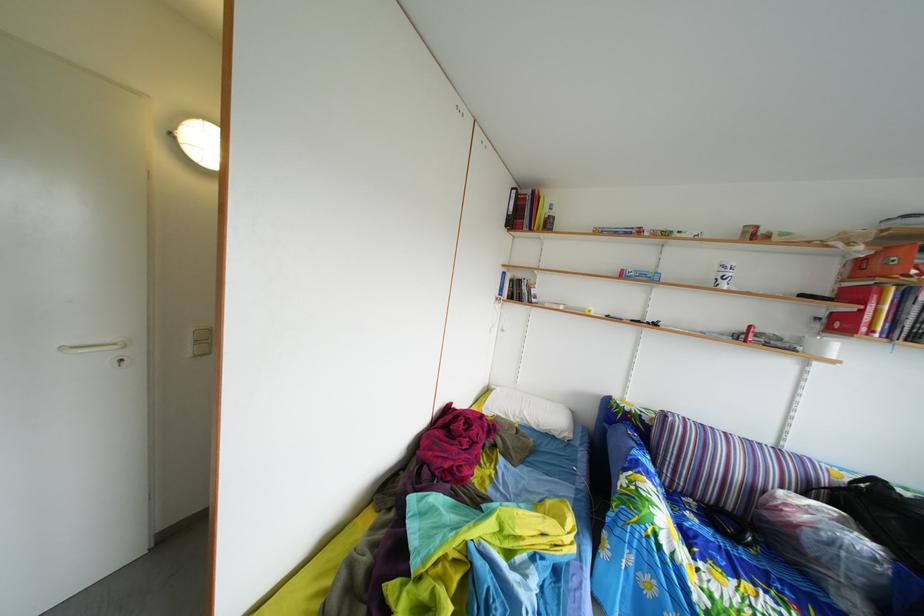
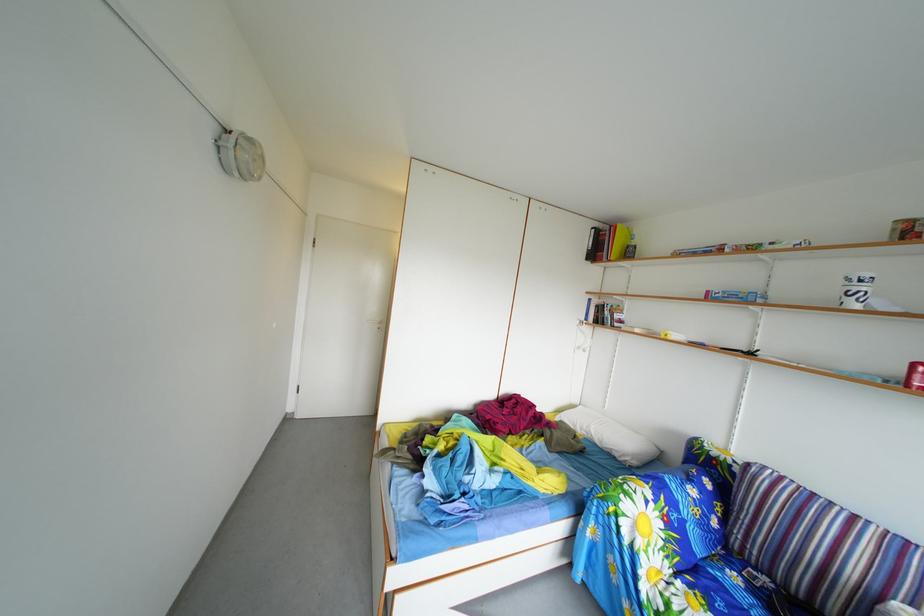
Where in the second image is the point corresponding to the point at 735,275 from the first image?

(859, 288)